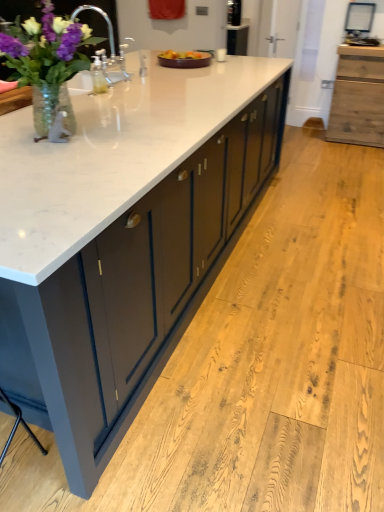
The height and width of the screenshot is (512, 384). What do you see at coordinates (47, 62) in the screenshot? I see `clear glass vase at left` at bounding box center [47, 62].

Identify the location of white marble countertop at center. The width and height of the screenshot is (384, 512). (115, 243).

What do you see at coordinates (358, 97) in the screenshot?
I see `wooden cabinet at right` at bounding box center [358, 97].

What do you see at coordinates (184, 59) in the screenshot?
I see `brown ceramic tray at center` at bounding box center [184, 59].

The image size is (384, 512). Find the location of `clear glass vase at left`. clear glass vase at left is located at coordinates (47, 62).

From the picture: From the image's perspective, is wooden cabinet at right located above white glossy sink at upper left?

Yes.

Is wooden cabinet at right closer to the viewer compared to white glossy sink at upper left?

No, wooden cabinet at right is behind white glossy sink at upper left.

Find the location of a particular element. The width and height of the screenshot is (384, 512). cabinetry that appears behind the white glossy sink at upper left is located at coordinates (358, 97).

How different are the orientations of wooden cabinet at right and white glossy sink at upper left in degrees?

wooden cabinet at right and white glossy sink at upper left are facing 89.8 degrees away from each other.

Which is closer to the camera, (x=365, y=121) or (x=188, y=54)?

Point (x=365, y=121) appears to be farther away from the viewer than point (x=188, y=54).

Identify the location of cabinetry behind the brown ceramic tray at center. (358, 97).

Is wooden cabinet at right facing towards brown ceramic tray at center?

No, wooden cabinet at right is not aimed at brown ceramic tray at center.

Is wooden cabinet at right thinner than brown ceramic tray at center?

No.

Which point is more forward, (28,261) or (75,51)?

Point (28,261)

Considering the positions of objects white marble countertop at center and clear glass vase at left in the image provided, who is more to the left, white marble countertop at center or clear glass vase at left?

clear glass vase at left is more to the left.

Where is `countertop below the clear glass vase at left (from a real-world perspective)`? countertop below the clear glass vase at left (from a real-world perspective) is located at coordinates (115, 243).

Is the surface of white marble countertop at center in direct contact with clear glass vase at left?

No, white marble countertop at center is not in contact with clear glass vase at left.

From the picture: From the image's perspective, does white marble countertop at center appear lower than white glossy sink at upper left?

Correct, white marble countertop at center appears lower than white glossy sink at upper left in the image.

Consider the image. Between white marble countertop at center and white glossy sink at upper left, which one has larger size?

With larger size is white marble countertop at center.

From a real-world perspective, between white marble countertop at center and white glossy sink at upper left, who is vertically higher?

In real-world perspective, white glossy sink at upper left is above.

From the image's perspective, is wooden cabinet at right on white marble countertop at center?

Correct, wooden cabinet at right appears higher than white marble countertop at center in the image.

Can white marble countertop at center be found inside wooden cabinet at right?

Definitely not — white marble countertop at center is not inside wooden cabinet at right.

From a real-world perspective, is wooden cabinet at right above or below white marble countertop at center?

From a real-world perspective, wooden cabinet at right is physically below white marble countertop at center.

Which is in front, point (337, 131) or point (58, 431)?

The point (58, 431) is in front.

Does white marble countertop at center have a greater width compared to brown ceramic tray at center?

Yes, white marble countertop at center is wider than brown ceramic tray at center.

From the image's perspective, is white marble countertop at center above or below brown ceramic tray at center?

white marble countertop at center is below brown ceramic tray at center.

Can you tell me how much white marble countertop at center and brown ceramic tray at center differ in facing direction?

The facing directions of white marble countertop at center and brown ceramic tray at center are 0.325 degrees apart.

Is white glossy sink at upper left in front of or behind white marble countertop at center in the image?

In the image, white glossy sink at upper left appears behind white marble countertop at center.

Considering the sizes of objects white glossy sink at upper left and white marble countertop at center in the image provided, who is smaller, white glossy sink at upper left or white marble countertop at center?

white glossy sink at upper left is smaller.

From a real-world perspective, between white glossy sink at upper left and white marble countertop at center, who is vertically lower?

white marble countertop at center, from a real-world perspective.

Between white glossy sink at upper left and white marble countertop at center, which one has larger width?

Wider between the two is white marble countertop at center.

The image size is (384, 512). Find the location of `sink below the wooden cabinet at right (from the image's perspective)`. sink below the wooden cabinet at right (from the image's perspective) is located at coordinates (110, 49).

At what (x,y) coordinates should I click in order to perform the action: click on cabinetry on the right of brown ceramic tray at center. Please return your answer as a coordinate pair (x, y). Looking at the image, I should click on (358, 97).

When comparing their distances from brown ceramic tray at center, does wooden cabinet at right or clear glass vase at left seem closer?

The object closer to brown ceramic tray at center is clear glass vase at left.

From the image, which object appears to be farther from wooden cabinet at right, white glossy sink at upper left or brown ceramic tray at center?

Among the two, white glossy sink at upper left is located further to wooden cabinet at right.

From the image, which object appears to be nearer to brown ceramic tray at center, clear glass vase at left or wooden cabinet at right?

clear glass vase at left is positioned closer to the anchor brown ceramic tray at center.

Looking at this image, estimate the real-world distances between objects in this image. Which object is closer to white marble countertop at center, brown ceramic tray at center or clear glass vase at left?

clear glass vase at left.

Which object lies further to the anchor point wooden cabinet at right, white glossy sink at upper left or clear glass vase at left?

Based on the image, clear glass vase at left appears to be further to wooden cabinet at right.

Considering their positions, is clear glass vase at left positioned further to white marble countertop at center than white glossy sink at upper left?

white glossy sink at upper left is further to white marble countertop at center.

Which object lies further to the anchor point white marble countertop at center, brown ceramic tray at center or white glossy sink at upper left?

brown ceramic tray at center is positioned further to the anchor white marble countertop at center.

Which object lies nearer to the anchor point clear glass vase at left, brown ceramic tray at center or wooden cabinet at right?

brown ceramic tray at center is closer to clear glass vase at left.

The width and height of the screenshot is (384, 512). Find the location of `houseplant between white glossy sink at upper left and wooden cabinet at right in the horizontal direction`. houseplant between white glossy sink at upper left and wooden cabinet at right in the horizontal direction is located at coordinates (47, 62).

Where is `houseplant between white marble countertop at center and brown ceramic tray at center along the z-axis`? houseplant between white marble countertop at center and brown ceramic tray at center along the z-axis is located at coordinates (47, 62).

You are a GUI agent. You are given a task and a screenshot of the screen. Output one action in this format:
    pyautogui.click(x=<x>, y=<y>)
    Task: Click on the sink between clear glass vase at left and brown ceramic tray at center along the z-axis
    Image resolution: width=384 pixels, height=512 pixels.
    Given the screenshot: What is the action you would take?
    pyautogui.click(x=110, y=49)

The width and height of the screenshot is (384, 512). I want to click on tray between white glossy sink at upper left and wooden cabinet at right in the horizontal direction, so click(x=184, y=59).